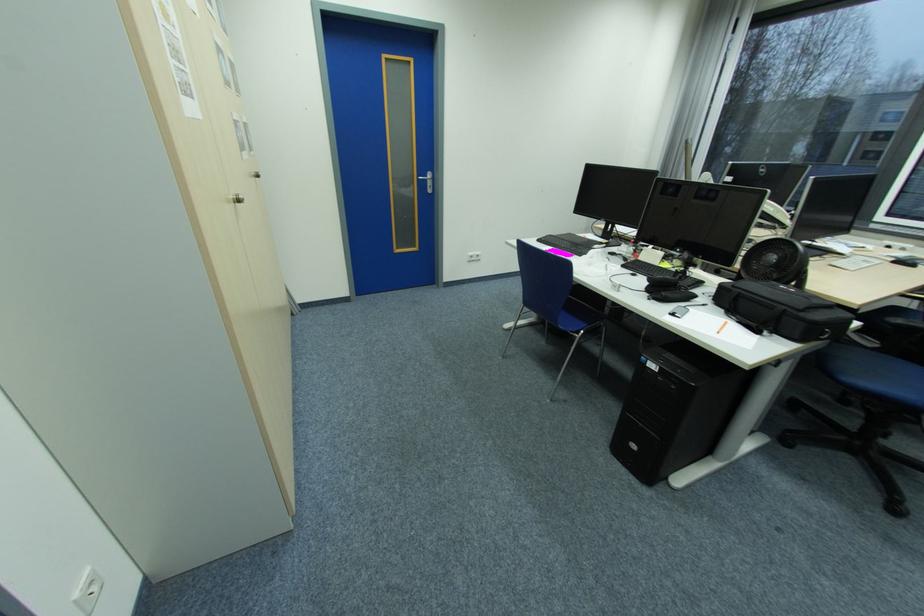
Which object does [722,326] point to?

It refers to a orange pencil.